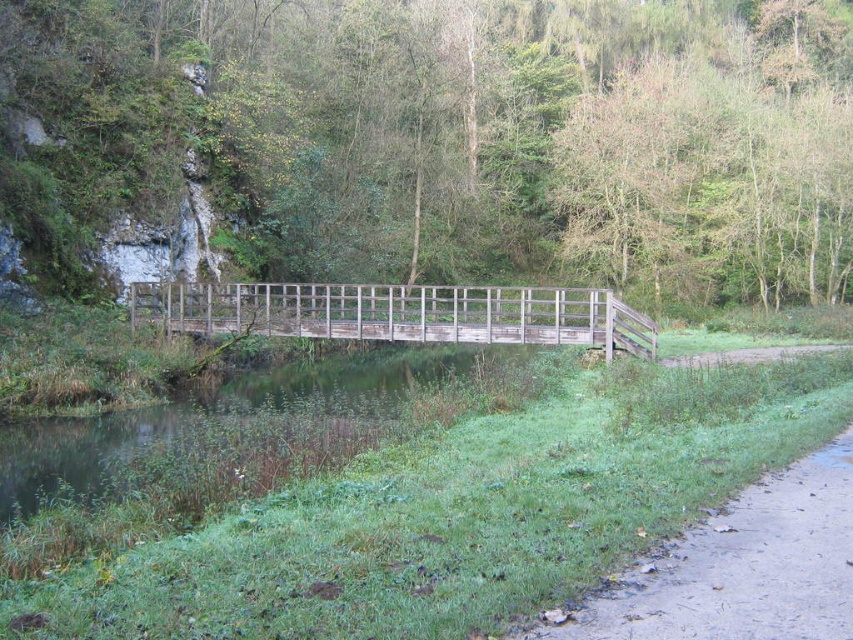
You are planning to walk across the weathered wood bridge at center, but you need to carry a large wooden crate that is 2 meters wide. The dirt path at lower right is where you came from. Can the bridge support the width of your crate?

The dirt path at lower right is narrower than the weathered wood bridge at center, but the bridge is wider than the path. Since the crate is 2 meters wide, the bridge should be able to accommodate it as long as its width is at least 2 meters. However, the exact width of the bridge isn

You are standing on the dirt path at lower right and want to cross the weathered wood bridge at center. In which direction should you walk to reach the bridge?

The dirt path at lower right is to the right of the weathered wood bridge at center, so you should walk to the left to reach the bridge.